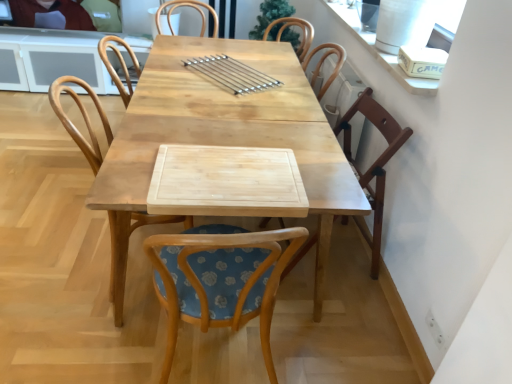
Identify the location of free location in front of wooden chair at right, which ranks as the 1th chair in right-to-left order. (338, 319).